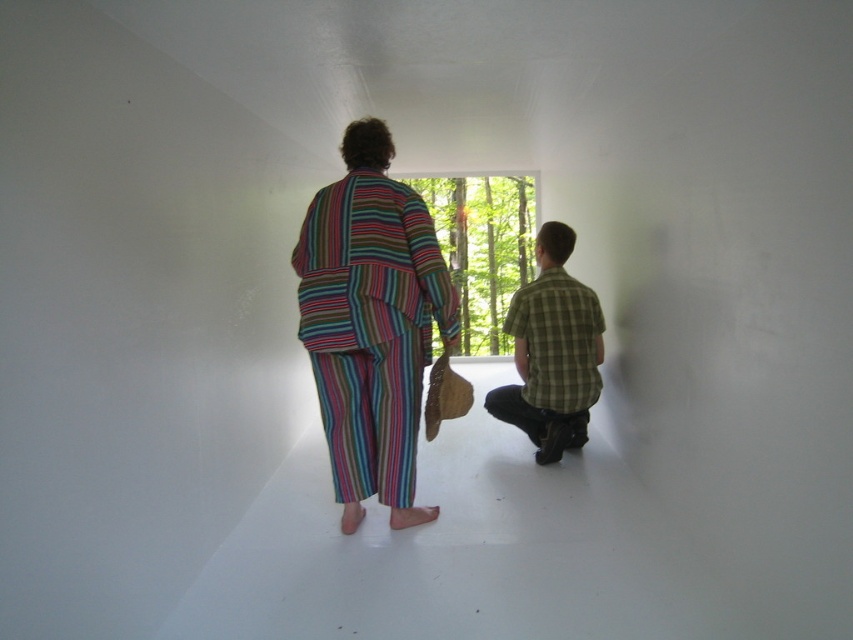
Who is shorter, multicolored striped robe at center or green plaid shirt at center?

Standing shorter between the two is green plaid shirt at center.

Based on the photo, is multicolored striped robe at center shorter than green plaid shirt at center?

No, multicolored striped robe at center is not shorter than green plaid shirt at center.

This screenshot has width=853, height=640. Identify the location of multicolored striped robe at center. (370, 326).